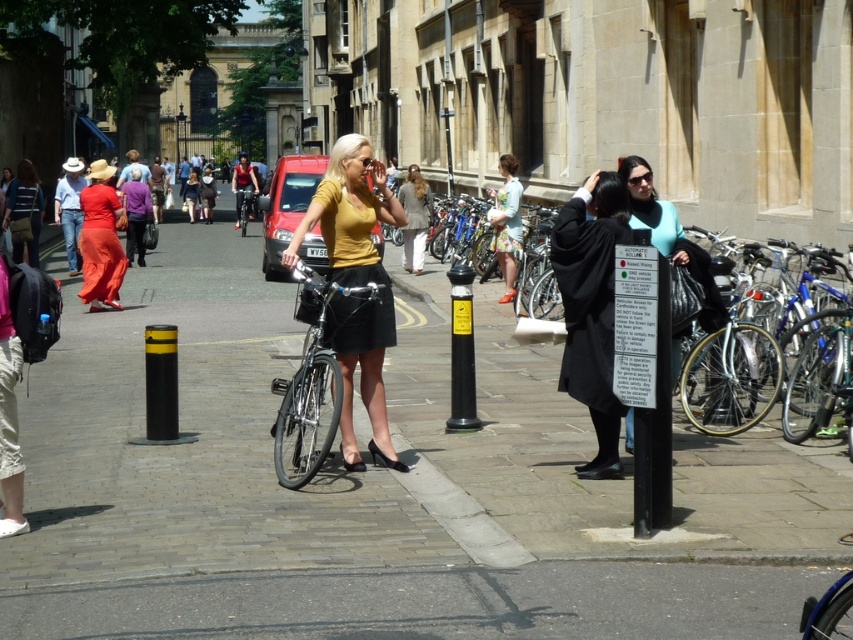
Question: Which point appears farthest from the camera in this image?

Choices:
 (A) (415, 232)
 (B) (323, 312)

Answer: (A)

Question: Can you confirm if yellow matte shirt at center is bigger than matte red dress at left?

Choices:
 (A) no
 (B) yes

Answer: (A)

Question: Which object is closer to the camera taking this photo?

Choices:
 (A) matte red dress at left
 (B) light beige cotton pants at center
 (C) black smooth pole at center
 (D) shiny silver bicycle at center

Answer: (D)

Question: Which point is closer to the camera?

Choices:
 (A) (463, 269)
 (B) (341, 173)
 (C) (665, 477)

Answer: (C)

Question: Is shiny silver bicycle at center closer to camera compared to shiny metallic bicycle at center?

Choices:
 (A) no
 (B) yes

Answer: (B)

Question: Can you confirm if yellow matte shirt at center is thinner than black smooth pole at center?

Choices:
 (A) no
 (B) yes

Answer: (A)